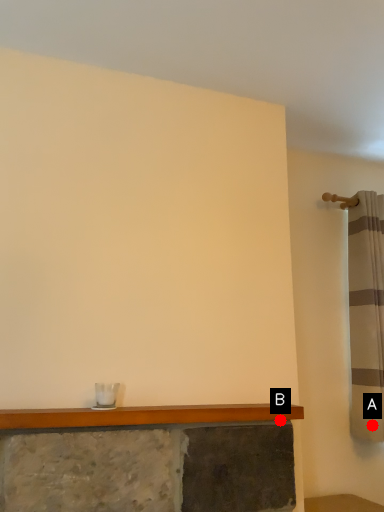
Question: Two points are circled on the image, labeled by A and B beside each circle. Among these points, which one is farthest from the camera?

Choices:
 (A) A is further
 (B) B is further

Answer: (A)